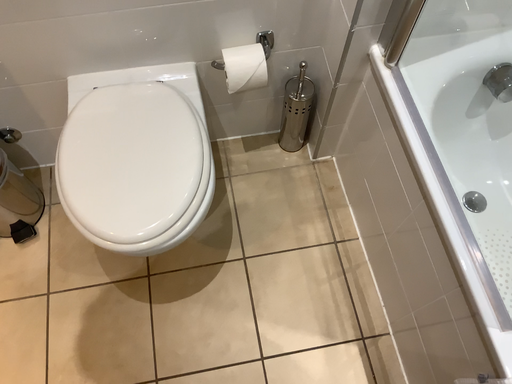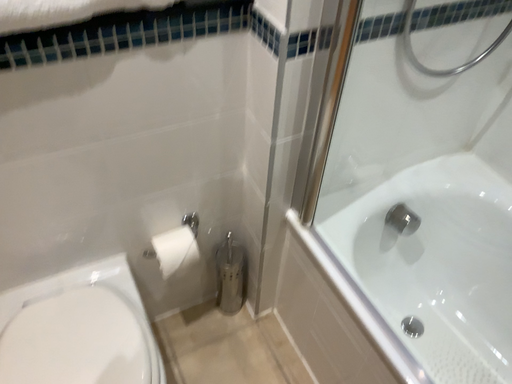
Question: How did the camera likely rotate when shooting the video?

Choices:
 (A) rotated upward
 (B) rotated downward

Answer: (A)